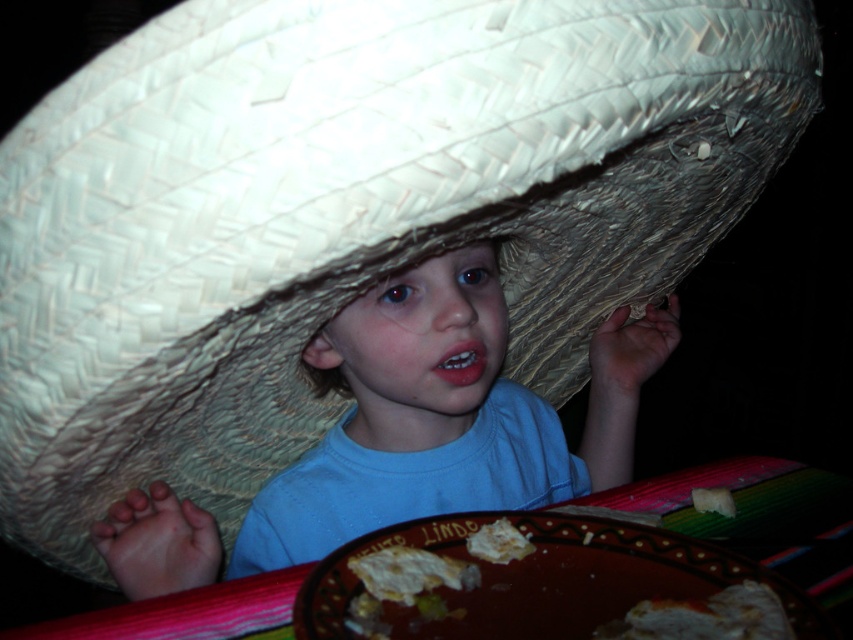
Question: Considering the real-world distances, which object is farthest from the white crumbly bread at lower right?

Choices:
 (A) white crumbly cheese at lower center
 (B) yellowish crumbly bread at lower center

Answer: (A)

Question: Which object is positioned closest to the yellowish crumbly bread at lower center?

Choices:
 (A) white crumbly bread at lower right
 (B) white crumbly cheese at lower center
 (C) white crumbly bread at lower center
 (D) brown ceramic platter at lower center

Answer: (C)

Question: Among these points, which one is nearest to the camera?

Choices:
 (A) (521, 547)
 (B) (734, 589)

Answer: (B)

Question: Is brown ceramic platter at lower center thinner than matte straw hat at center?

Choices:
 (A) yes
 (B) no

Answer: (A)

Question: Is brown ceramic platter at lower center thinner than yellowish crumbly bread at lower center?

Choices:
 (A) no
 (B) yes

Answer: (A)

Question: Does white crumbly bread at lower right come behind white crumbly bread at lower center?

Choices:
 (A) yes
 (B) no

Answer: (B)